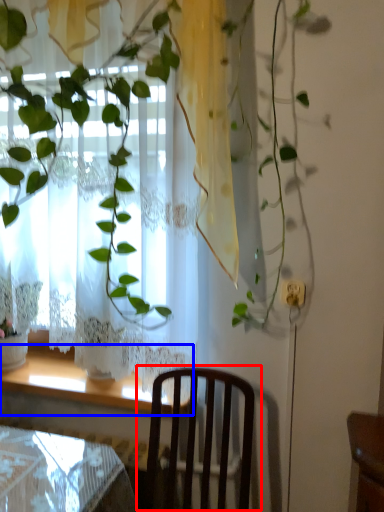
Question: Which of the following is the farthest to the observer, chair (highlighted by a red box) or window sill (highlighted by a blue box)?

Choices:
 (A) chair
 (B) window sill

Answer: (B)